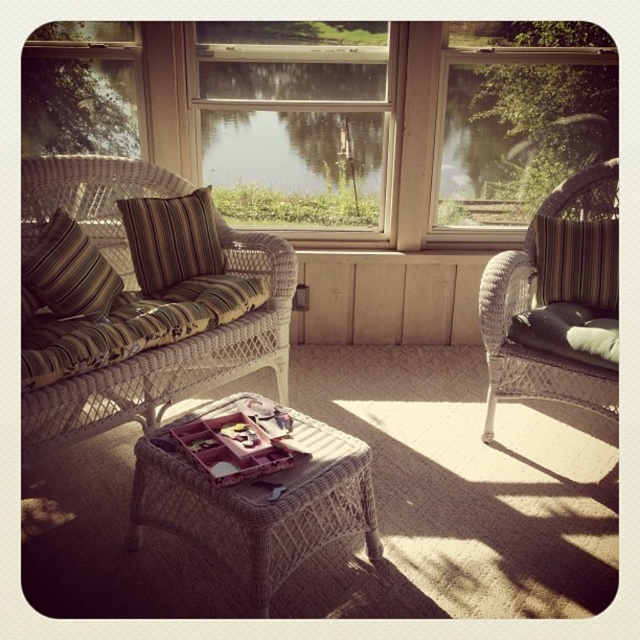
Is transparent glass window at upper right shorter than brown striped pillow at left?

In fact, transparent glass window at upper right may be taller than brown striped pillow at left.

How distant is transparent glass window at upper right from brown striped pillow at left?

transparent glass window at upper right and brown striped pillow at left are 4.97 feet apart from each other.

This screenshot has width=640, height=640. What do you see at coordinates (520, 116) in the screenshot?
I see `transparent glass window at upper right` at bounding box center [520, 116].

The image size is (640, 640). In order to click on transparent glass window at upper right in this screenshot , I will do `click(520, 116)`.

Who is more forward, (232, 156) or (481, 68)?

Positioned in front is point (481, 68).

Based on the photo, between clear glass window at center and transparent glass window at upper right, which one is positioned lower?

transparent glass window at upper right

Between point (273, 44) and point (476, 163), which one is positioned behind?

The point (476, 163) is behind.

Image resolution: width=640 pixels, height=640 pixels. Find the location of `clear glass window at center`. clear glass window at center is located at coordinates (292, 120).

Does transparent glass window at upper right have a greater width compared to white wicker couch at left?

No, transparent glass window at upper right is not wider than white wicker couch at left.

Measure the distance between point [524,163] and camera.

Point [524,163] and camera are 2.94 meters apart.

This screenshot has height=640, width=640. In order to click on transparent glass window at upper right in this screenshot , I will do `click(520, 116)`.